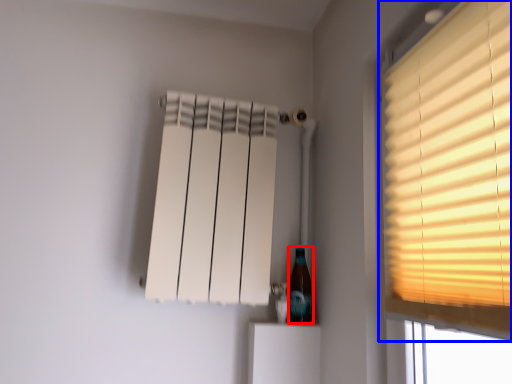
Question: Which object is closer to the camera taking this photo, bottle (highlighted by a red box) or window (highlighted by a blue box)?

Choices:
 (A) bottle
 (B) window

Answer: (B)